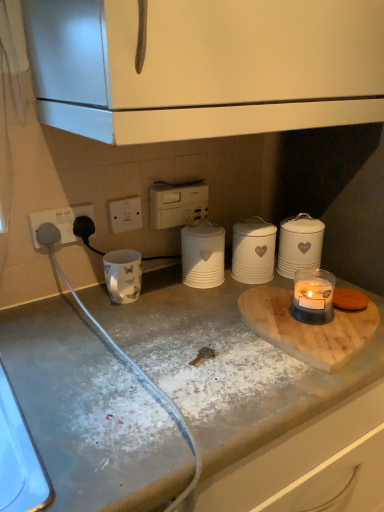
I want to click on vacant space situated above white speckled concrete at center (from a real-world perspective), so click(213, 327).